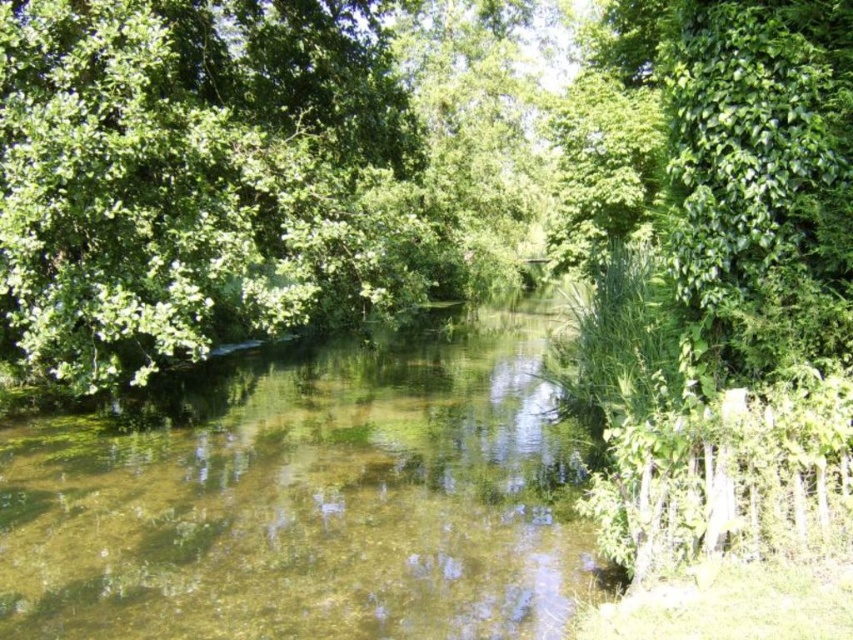
You are a bird looking for a place to perch. You see the green leafy tree at center and the clear water at center. Which location is taller?

The green leafy tree at center is much taller than the clear water at center, so the green leafy tree at center is taller.

You are a photographer wanting to capture the reflection of the green leafy tree at center in the clear water at center. Based on the scene, can you confirm if the tree is positioned in a way that its reflection would be visible in the water?

The green leafy tree at center is above clear water at center, so its reflection should be visible in the water since the tree is positioned directly over the water surface.

You are a hiker who wants to cross the clear water at center without getting your shoes wet. The green leafy tree at center is blocking your path. Can you walk around the tree to reach the water?

The green leafy tree at center is larger than the clear water at center, so it might block your path. However, since the tree is at the center and the water is also at the center, you might need to adjust your route to navigate around the tree to access the clear water at center.